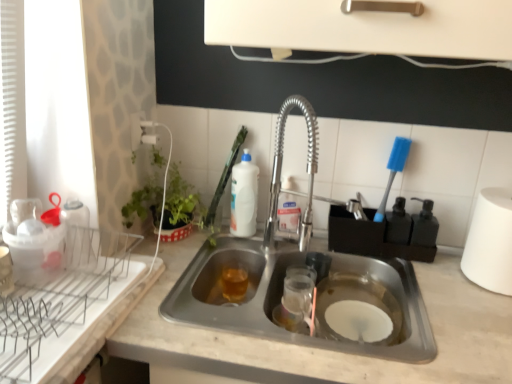
Locate an element on the screen. The image size is (512, 384). vacant space to the left of white matte paper towel at right is located at coordinates (448, 281).